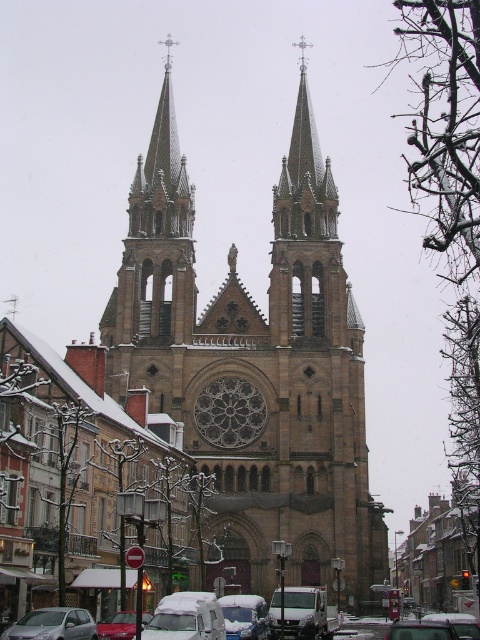
You are a delivery driver who needs to park either the silver metallic van at center or the metallic silver car at center in a parking spot that can only accommodate vehicles up to the size of the smaller one. Which vehicle should you choose?

You should choose the silver metallic van at center because it has a smaller size compared to the metallic silver car at center, making it suitable for the parking spot.

Based on the photo, you are a photographer planning to take a picture of the cathedral with the silver metallic van at center and the metallic silver car at center in the frame. Since both vehicles are silver, how can you distinguish them in your photo?

The silver metallic van at center is located above the metallic silver car at center, so you can distinguish them by their vertical positions in the photo.